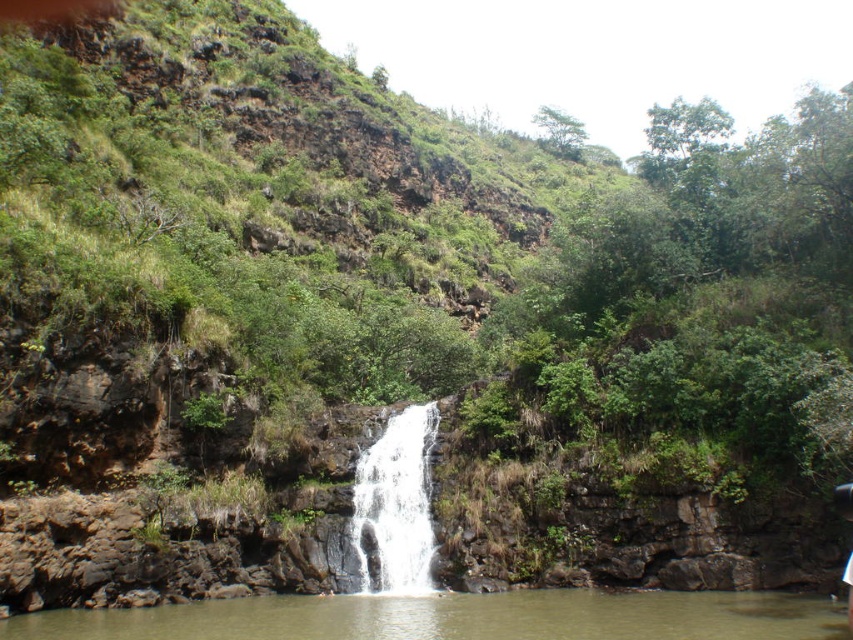
Question: Is green translucent water at center smaller than white smooth waterfall at center?

Choices:
 (A) no
 (B) yes

Answer: (A)

Question: Can you confirm if green translucent water at center is thinner than white smooth waterfall at center?

Choices:
 (A) no
 (B) yes

Answer: (A)

Question: Among these objects, which one is nearest to the camera?

Choices:
 (A) green translucent water at center
 (B) white smooth waterfall at center

Answer: (A)

Question: Is green translucent water at center to the right of white smooth waterfall at center from the viewer's perspective?

Choices:
 (A) no
 (B) yes

Answer: (B)